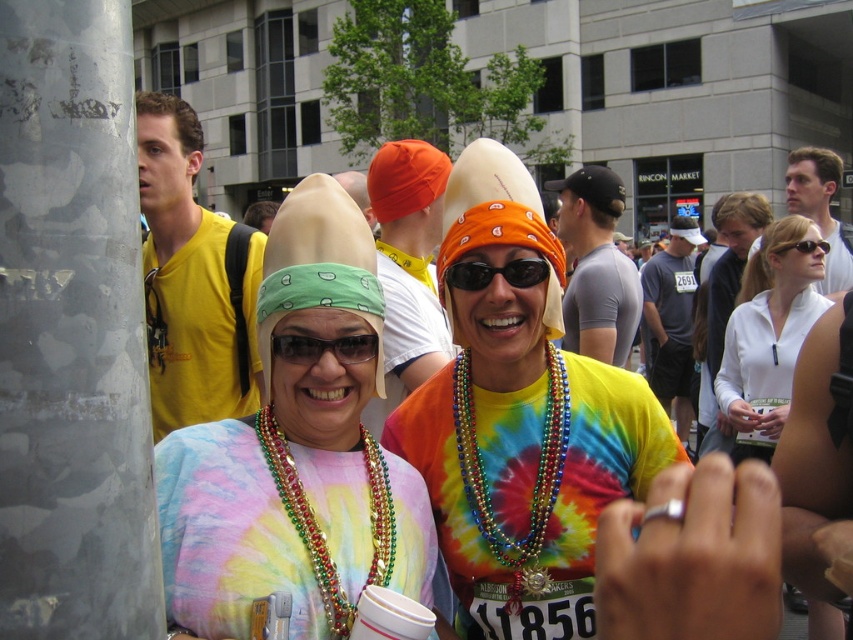
Question: Based on their relative distances, which object is nearer to the matte black shirt at upper right?

Choices:
 (A) gray t-shirt at center
 (B) orange fabric bandana at center
 (C) sunglasses at upper right
 (D) multicolored beads necklace at center

Answer: (C)

Question: Is yellow t-shirt at left to the left of gray t-shirt at center from the viewer's perspective?

Choices:
 (A) no
 (B) yes

Answer: (B)

Question: Which point is closer to the camera taking this photo?

Choices:
 (A) (473, 289)
 (B) (473, 394)

Answer: (A)

Question: Can you confirm if orange fabric beanie at center is positioned above matte black sunglasses at center?

Choices:
 (A) yes
 (B) no

Answer: (A)

Question: Which object appears closest to the camera in this image?

Choices:
 (A) matte black sunglasses at center
 (B) orange fabric beanie at center
 (C) sunglasses at upper right

Answer: (A)

Question: Considering the relative positions of yellow t-shirt at left and matte black sunglasses at center in the image provided, where is yellow t-shirt at left located with respect to matte black sunglasses at center?

Choices:
 (A) right
 (B) left

Answer: (B)